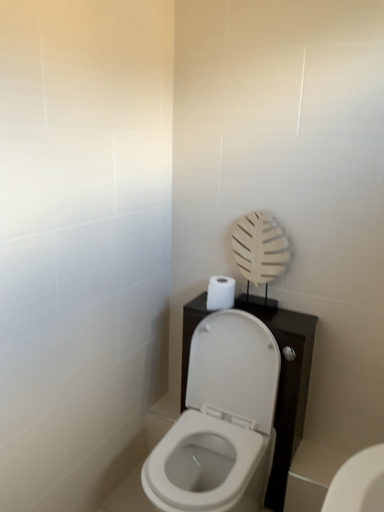
Question: Is white matte toilet paper at upper right taller or shorter than white glossy toilet at center, placed as the first toilet when sorted from top to bottom?

Choices:
 (A) short
 (B) tall

Answer: (A)

Question: Is white matte toilet paper at upper right situated inside white glossy toilet at center, positioned as the 2th toilet in right-to-left order, or outside?

Choices:
 (A) outside
 (B) inside

Answer: (A)

Question: Which object is the farthest from the white glossy toilet at lower right, positioned as the 2th toilet in left-to-right order?

Choices:
 (A) white matte toilet paper at upper right
 (B) white glossy toilet at center, the second toilet positioned from the bottom

Answer: (A)

Question: Which of these objects is positioned farthest from the white glossy toilet at lower right, the 2th toilet positioned from the top?

Choices:
 (A) white glossy toilet at center, positioned as the 2th toilet in right-to-left order
 (B) white matte toilet paper at upper right

Answer: (B)